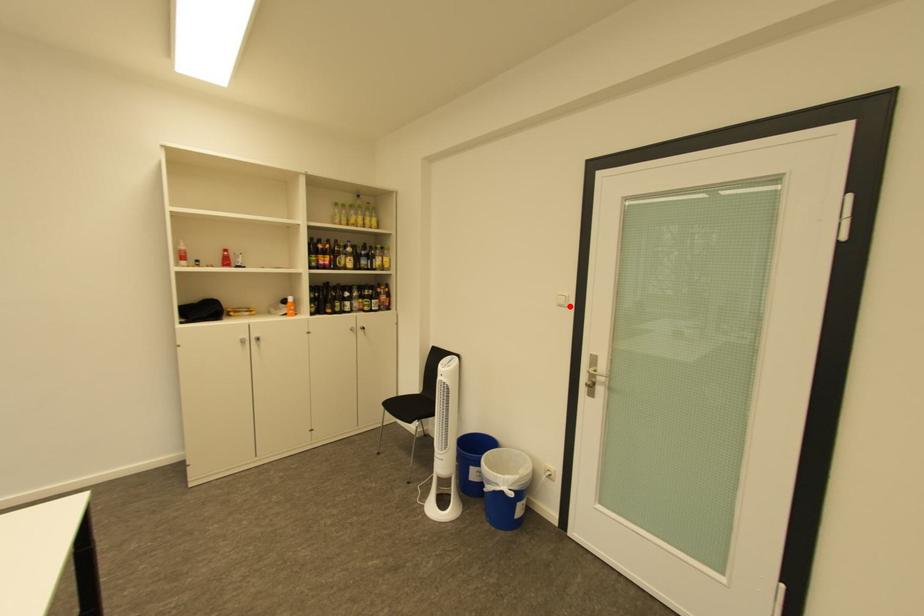
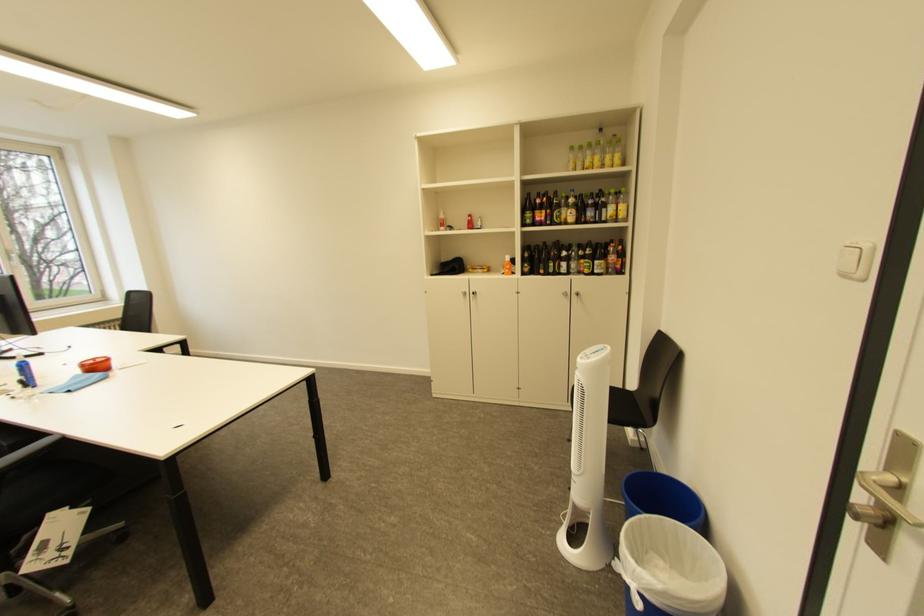
The point at the highlighted location is marked in the first image. Where is the corresponding point in the second image?

(855, 277)